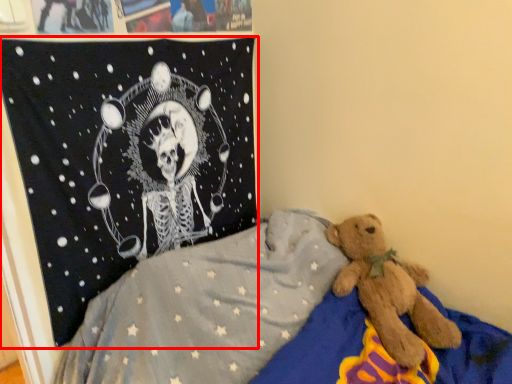
Question: In this image, where is pirate flag (annotated by the red box) located relative to bed?

Choices:
 (A) right
 (B) left

Answer: (B)